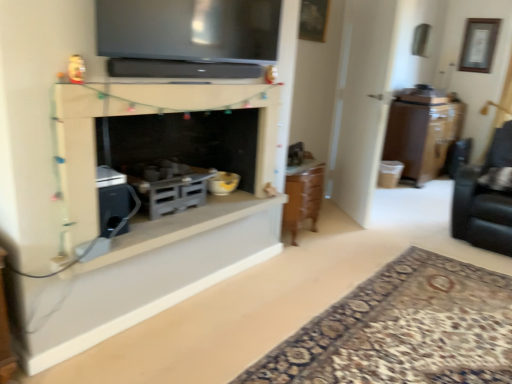
Describe the element at coordinates (422, 131) in the screenshot. I see `brown wood cabinet at right` at that location.

At what (x,y) coordinates should I click in order to perform the action: click on wooden framed artwork at upper right, the second picture frame viewed from the left. Please return your answer as a coordinate pair (x, y). Looking at the image, I should click on (479, 44).

What do you see at coordinates (479, 44) in the screenshot? The height and width of the screenshot is (384, 512). I see `wooden framed artwork at upper right, which is the 2th picture frame in front-to-back order` at bounding box center [479, 44].

Image resolution: width=512 pixels, height=384 pixels. What do you see at coordinates (486, 197) in the screenshot? I see `black leather swivel chair at right` at bounding box center [486, 197].

At what (x,y) coordinates should I click in order to perform the action: click on black matte soundbar at upper center, marked as the third appliance in a bottom-to-top arrangement. Please return your answer as a coordinate pair (x, y). Image resolution: width=512 pixels, height=384 pixels. Looking at the image, I should click on (180, 69).

What do you see at coordinates (223, 183) in the screenshot? This screenshot has height=384, width=512. I see `white glossy bowl at center, the 2th appliance from the top` at bounding box center [223, 183].

Find the location of `brown wood cabinet at right`. brown wood cabinet at right is located at coordinates (422, 131).

Can you confirm if white matte fireplace at center is positioned to the left of white matte fireplace at center, the 1th window sill in the top-to-bottom sequence?

Incorrect, white matte fireplace at center is not on the left side of white matte fireplace at center, the 1th window sill in the top-to-bottom sequence.

Is white matte fireplace at center looking in the opposite direction of white matte fireplace at center, the 1th window sill in the top-to-bottom sequence?

No, white matte fireplace at center is not facing away from white matte fireplace at center, the 1th window sill in the top-to-bottom sequence.

Which point is more forward, [185,104] or [250,206]?

The point [185,104] is closer to the camera.

Can you confirm if white matte fireplace at center is taller than white matte fireplace at center, the 1th window sill in the top-to-bottom sequence?

Yes.

Is matte black tv at upper center thinner than matte gray stove at center, the 1th appliance ordered from the bottom?

Indeed, matte black tv at upper center has a lesser width compared to matte gray stove at center, the 1th appliance ordered from the bottom.

Does matte black tv at upper center touch matte gray stove at center, the 1th appliance ordered from the bottom?

No, matte black tv at upper center is not next to matte gray stove at center, the 1th appliance ordered from the bottom.

Considering the sizes of objects matte black tv at upper center and matte gray stove at center, the 1th appliance ordered from the bottom, in the image provided, who is bigger, matte black tv at upper center or matte gray stove at center, the 1th appliance ordered from the bottom,?

With larger size is matte black tv at upper center.

Is point (152, 37) positioned before point (153, 219)?

Yes, point (152, 37) is in front of point (153, 219).

Who is shorter, brown wood cabinet at right or black matte soundbar at upper center, marked as the third appliance in a bottom-to-top arrangement?

black matte soundbar at upper center, marked as the third appliance in a bottom-to-top arrangement, is shorter.

Are brown wood cabinet at right and black matte soundbar at upper center, marked as the third appliance in a bottom-to-top arrangement, beside each other?

They are not placed beside each other.

Is brown wood cabinet at right outside of black matte soundbar at upper center, the 1th appliance in the top-to-bottom sequence?

brown wood cabinet at right is positioned outside black matte soundbar at upper center, the 1th appliance in the top-to-bottom sequence.

From the image's perspective, starting from the brown wood cabinet at right, which picture frame is the 1st one above? Please provide its 2D coordinates.

[(313, 20)]

Visually, is wooden picture frame at upper center, the 2th picture frame when ordered from top to bottom, positioned to the left or to the right of brown wood cabinet at right?

Based on their positions, wooden picture frame at upper center, the 2th picture frame when ordered from top to bottom, is located to the left of brown wood cabinet at right.

Is wooden picture frame at upper center, which is the first picture frame in left-to-right order, behind brown wood cabinet at right?

No, wooden picture frame at upper center, which is the first picture frame in left-to-right order, is closer to the viewer.

Can we say wooden framed artwork at upper right, acting as the first picture frame starting from the right, lies outside wooden picture frame at upper center, the 2th picture frame when ordered from top to bottom?

Yes, wooden framed artwork at upper right, acting as the first picture frame starting from the right, is not within wooden picture frame at upper center, the 2th picture frame when ordered from top to bottom.

Would you consider wooden framed artwork at upper right, arranged as the first picture frame when viewed from the back, to be distant from wooden picture frame at upper center, the 1th picture frame in the bottom-to-top sequence?

Absolutely, wooden framed artwork at upper right, arranged as the first picture frame when viewed from the back, is distant from wooden picture frame at upper center, the 1th picture frame in the bottom-to-top sequence.

Identify the location of picture frame located below the wooden framed artwork at upper right, the second picture frame viewed from the left (from the image's perspective). This screenshot has width=512, height=384. (313, 20).

Does black leather swivel chair at right contain matte black tv at upper center?

That's incorrect, matte black tv at upper center is not inside black leather swivel chair at right.

Considering the sizes of black leather swivel chair at right and matte black tv at upper center in the image, is black leather swivel chair at right wider or thinner than matte black tv at upper center?

Considering their sizes, black leather swivel chair at right looks broader than matte black tv at upper center.

Which of these two, black leather swivel chair at right or matte black tv at upper center, stands taller?

With more height is black leather swivel chair at right.

From the image's perspective, is black leather swivel chair at right on top of matte black tv at upper center?

No, from the image's perspective, black leather swivel chair at right is not over matte black tv at upper center.

Between matte black tv at upper center and carpet with intricate pattern at lower right, which one is positioned behind?

Positioned behind is matte black tv at upper center.

From the image's perspective, relative to carpet with intricate pattern at lower right, is matte black tv at upper center above or below?

→ matte black tv at upper center is above carpet with intricate pattern at lower right.

How far apart are matte black tv at upper center and carpet with intricate pattern at lower right?

matte black tv at upper center and carpet with intricate pattern at lower right are 5.26 feet apart.

From the picture: Is matte black tv at upper center spatially inside carpet with intricate pattern at lower right, or outside of it?

matte black tv at upper center is not inside carpet with intricate pattern at lower right, it's outside.

There is a white matte fireplace at center. In order to click on the 1st window sill below it (from the image's perspective) in this screenshot , I will do `click(180, 226)`.

Find the location of a particular element. television located in front of the matte gray stove at center, the third appliance when ordered from top to bottom is located at coordinates (189, 30).

Based on their spatial positions, is matte black tv at upper center or wooden framed artwork at upper right, which is the 1th picture frame from top to bottom, closer to brown wood cabinet at right?

wooden framed artwork at upper right, which is the 1th picture frame from top to bottom, is closer to brown wood cabinet at right.

From the image, which object appears to be nearer to black leather swivel chair at right, white smooth baseboard at lower center, which ranks as the 2th window sill in top-to-bottom order, or white matte fireplace at center, which appears as the 2th window sill when ordered from the bottom?

white matte fireplace at center, which appears as the 2th window sill when ordered from the bottom, lies closer to black leather swivel chair at right than the other object.

Estimate the real-world distances between objects in this image. Which object is further from white matte fireplace at center, wooden picture frame at upper center, the 1th picture frame in the bottom-to-top sequence, or black leather swivel chair at right?

Based on the image, black leather swivel chair at right appears to be further to white matte fireplace at center.

Looking at the image, which one is located further to white matte fireplace at center, wooden framed artwork at upper right, arranged as the first picture frame when viewed from the back, or brown wood cabinet at right?

wooden framed artwork at upper right, arranged as the first picture frame when viewed from the back, is further to white matte fireplace at center.

Based on their spatial positions, is black matte soundbar at upper center, the 1th appliance in the top-to-bottom sequence, or white matte fireplace at center, the 1th window sill in the top-to-bottom sequence, closer to carpet with intricate pattern at lower right?

white matte fireplace at center, the 1th window sill in the top-to-bottom sequence, lies closer to carpet with intricate pattern at lower right than the other object.

Considering their positions, is carpet with intricate pattern at lower right positioned closer to white smooth baseboard at lower center, the first window sill from the bottom, than brown wood cabinet at right?

Based on the image, carpet with intricate pattern at lower right appears to be nearer to white smooth baseboard at lower center, the first window sill from the bottom.

Looking at the image, which one is located further to white glossy bowl at center, the 2th appliance when ordered from bottom to top, white matte fireplace at center, the 1th window sill in the top-to-bottom sequence, or brown wood cabinet at right?

brown wood cabinet at right lies further to white glossy bowl at center, the 2th appliance when ordered from bottom to top, than the other object.

Considering their positions, is white matte fireplace at center, the 1th window sill in the top-to-bottom sequence, positioned closer to white glossy bowl at center, the 2th appliance from the top, than wooden framed artwork at upper right, arranged as the first picture frame when viewed from the back?

white matte fireplace at center, the 1th window sill in the top-to-bottom sequence, is positioned closer to the anchor white glossy bowl at center, the 2th appliance from the top.

Image resolution: width=512 pixels, height=384 pixels. Find the location of `fireplace situated between white smooth baseboard at lower center, the first window sill from the bottom, and carpet with intricate pattern at lower right from left to right`. fireplace situated between white smooth baseboard at lower center, the first window sill from the bottom, and carpet with intricate pattern at lower right from left to right is located at coordinates pyautogui.click(x=154, y=113).

The height and width of the screenshot is (384, 512). What are the coordinates of `picture frame between white glossy bowl at center, the 2th appliance when ordered from bottom to top, and brown wood cabinet at right, in the horizontal direction` in the screenshot? It's located at (313, 20).

I want to click on swivel chair between carpet with intricate pattern at lower right and wooden picture frame at upper center, the 1th picture frame from the front, in the front-back direction, so click(x=486, y=197).

This screenshot has width=512, height=384. I want to click on picture frame between white matte fireplace at center and black leather swivel chair at right, so click(x=313, y=20).